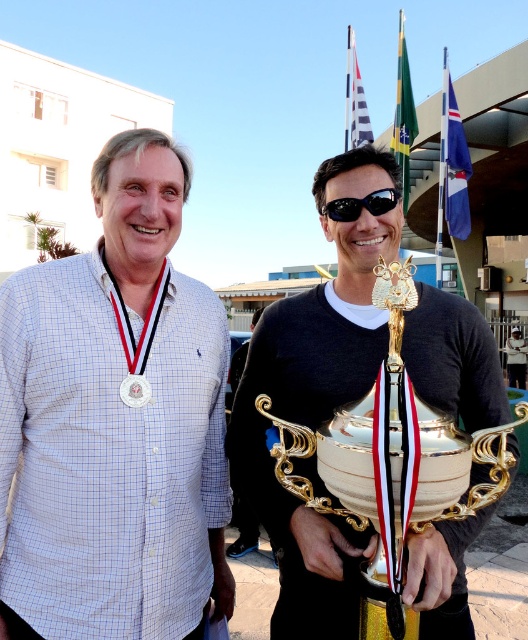
Is green fabric flag at upper center taller than white fabric flag at upper center?

Incorrect, green fabric flag at upper center's height is not larger of white fabric flag at upper center's.

Between green fabric flag at upper center and white fabric flag at upper center, which one has more height?

Standing taller between the two is white fabric flag at upper center.

Does point (400, 44) lie in front of point (363, 120)?

Yes.

I want to click on green fabric flag at upper center, so click(403, 115).

How far apart are black plastic goggles at center and gold metallic medal at center?

The distance of black plastic goggles at center from gold metallic medal at center is 83.11 centimeters.

Is point (365, 200) more distant than point (142, 376)?

Yes, point (365, 200) is farther from viewer.

Who is more distant from viewer, (356, 208) or (133, 378)?

The point (356, 208) is more distant.

The width and height of the screenshot is (528, 640). I want to click on black plastic goggles at center, so click(362, 204).

Can you confirm if blue fabric flag at upper right is thinner than green fabric flag at upper center?

Indeed, blue fabric flag at upper right has a lesser width compared to green fabric flag at upper center.

Is blue fabric flag at upper right positioned behind green fabric flag at upper center?

Yes.

Which is in front, point (447, 193) or point (407, 122)?

Point (447, 193) is in front.

Locate an element on the screen. This screenshot has width=528, height=640. blue fabric flag at upper right is located at coordinates (452, 163).